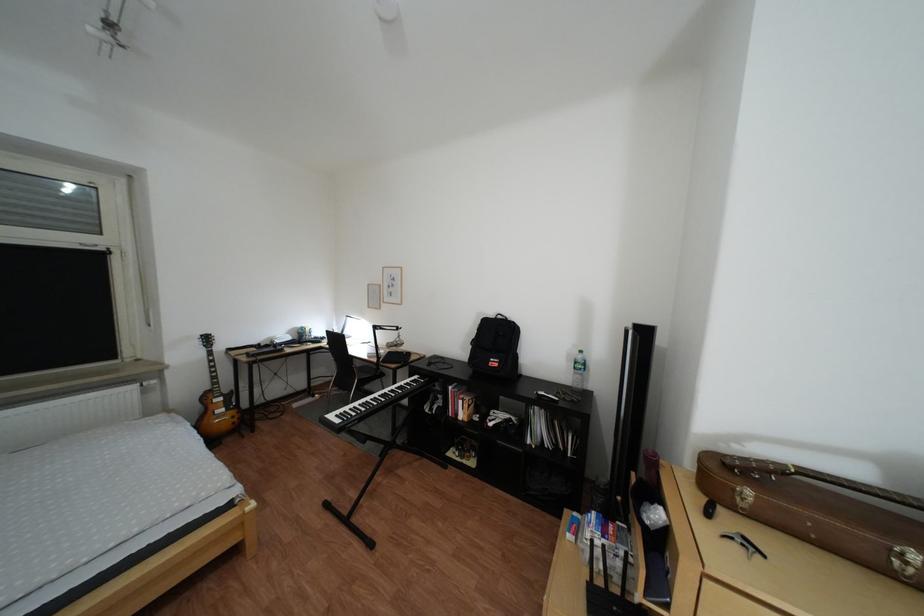
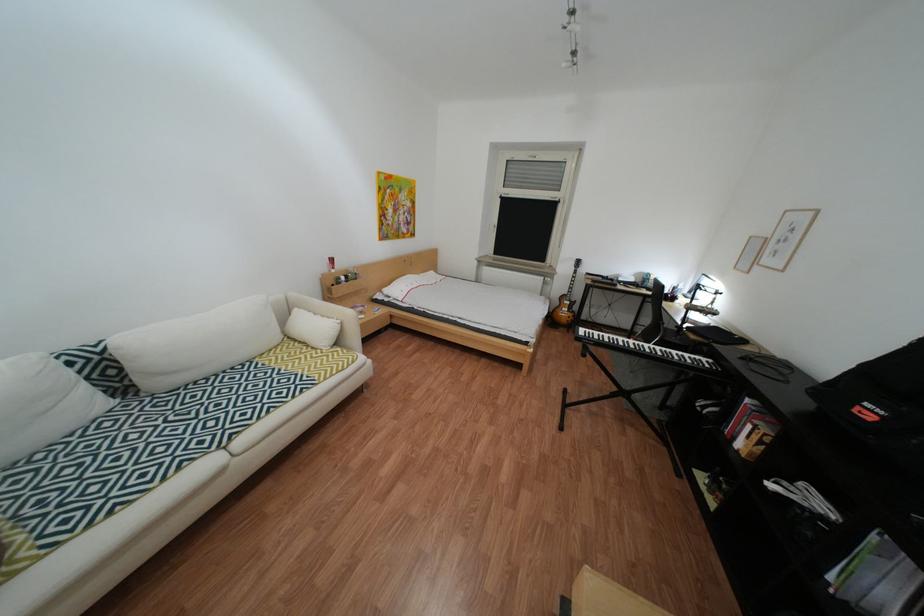
In the second image, find the point that corresponds to (472,416) in the first image.

(749, 439)